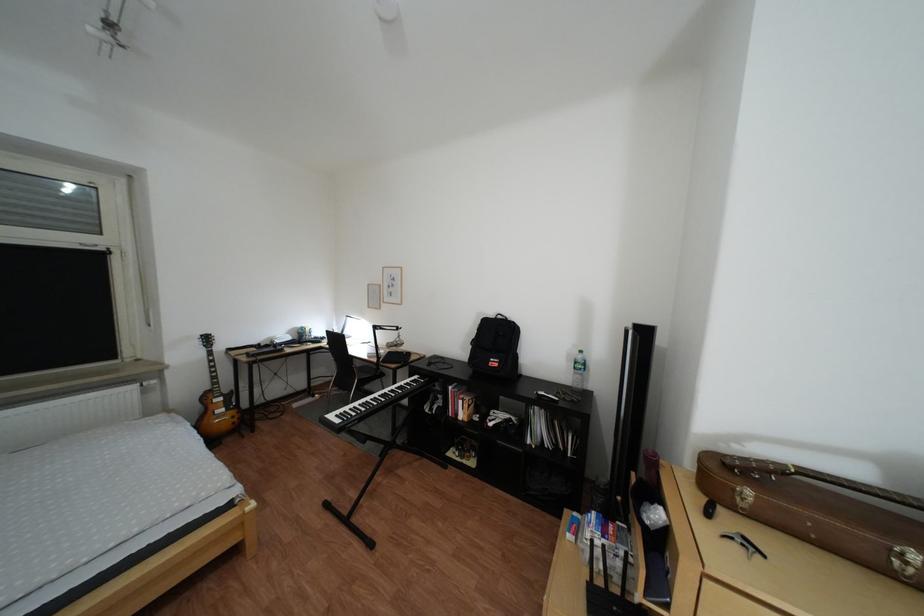
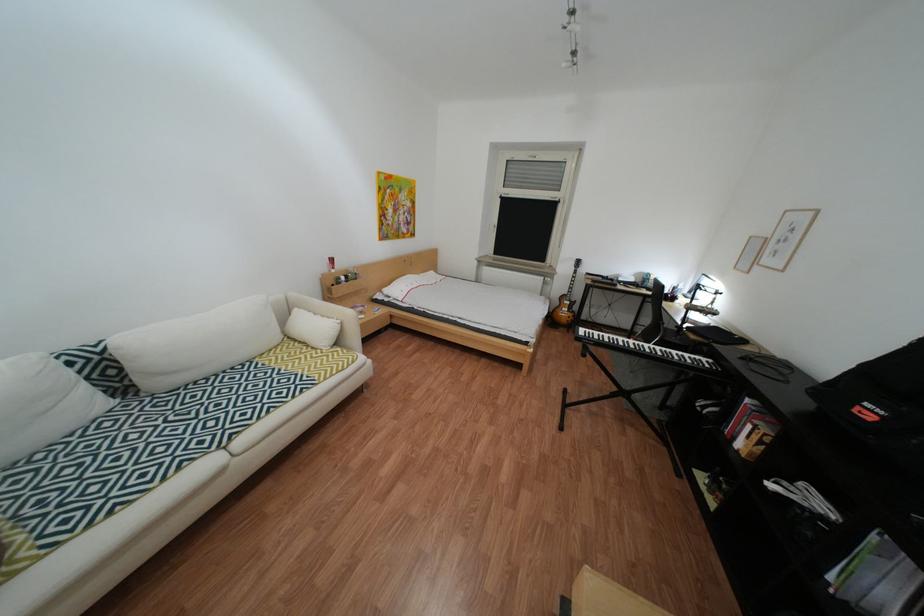
In the second image, find the point that corresponds to (472,416) in the first image.

(749, 439)